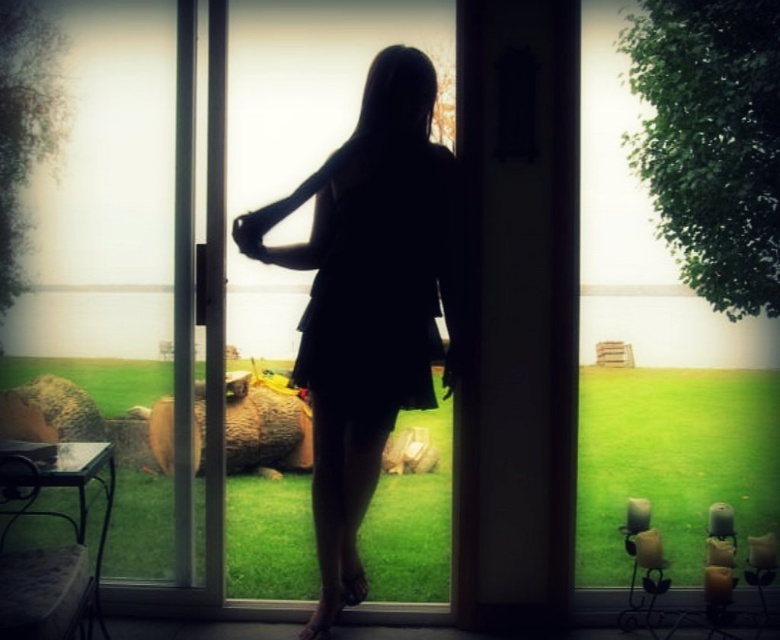
Question: Can you confirm if transparent glass window at center is thinner than silhouette dress at center?

Choices:
 (A) no
 (B) yes

Answer: (A)

Question: Which object appears farthest from the camera in this image?

Choices:
 (A) silhouette dress at center
 (B) transparent glass window at center

Answer: (B)

Question: Among these objects, which one is farthest from the camera?

Choices:
 (A) silhouette dress at center
 (B) transparent glass window at center

Answer: (B)

Question: Can you confirm if transparent glass window at center is smaller than silhouette dress at center?

Choices:
 (A) yes
 (B) no

Answer: (B)

Question: Is transparent glass window at center positioned in front of silhouette dress at center?

Choices:
 (A) no
 (B) yes

Answer: (A)